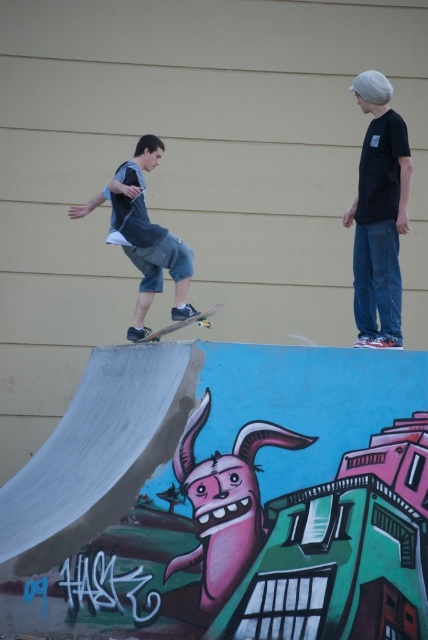
You are standing at the skatepark and want to place a small sticker between the two points, point (149, 241) and point (177, 328). Which point is closer to you so the sticker can be placed there?

Point (149, 241) is closer to you than point (177, 328), so the sticker should be placed near point (149, 241).